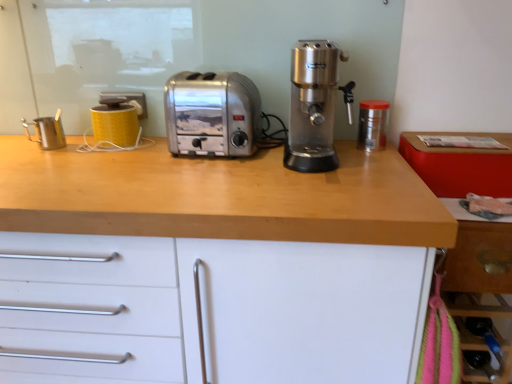
At what (x,y) coordinates should I click in order to perform the action: click on vacant area located to the right-hand side of satin silver coffee machine at center. Please return your answer as a coordinate pair (x, y). This screenshot has height=384, width=512. Looking at the image, I should click on (369, 150).